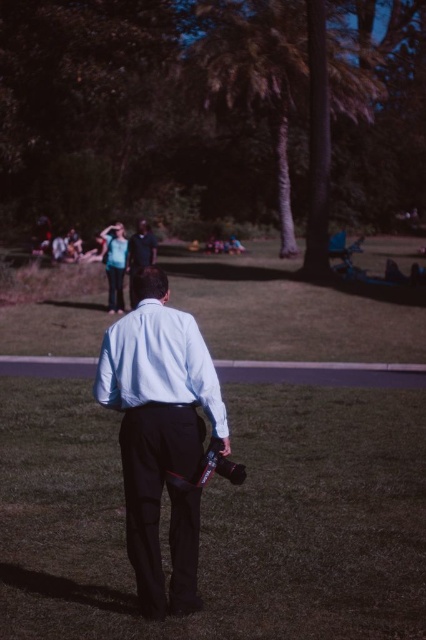
Which of these two, green grass at center or matte black shirt at center, stands shorter?

green grass at center is shorter.

Does point (255, 340) come behind point (137, 264)?

No, it is not.

Identify the location of green grass at center. The image size is (426, 640). (290, 310).

Locate an element on the screen. green grass at center is located at coordinates (290, 310).

Can you confirm if light blue shirt at center is positioned to the right of light blue cotton dress shirt at center?

Incorrect, light blue shirt at center is not on the right side of light blue cotton dress shirt at center.

Does point (149, 481) come farther from viewer compared to point (101, 352)?

No, it is in front of (101, 352).

Where is `light blue shirt at center`? light blue shirt at center is located at coordinates (157, 416).

Image resolution: width=426 pixels, height=640 pixels. In order to click on light blue shirt at center in this screenshot , I will do `click(157, 416)`.

Which of these two, black smooth pants at center or light blue shirt at center, stands shorter?

black smooth pants at center is shorter.

Identify the location of black smooth pants at center. The height and width of the screenshot is (640, 426). (221, 518).